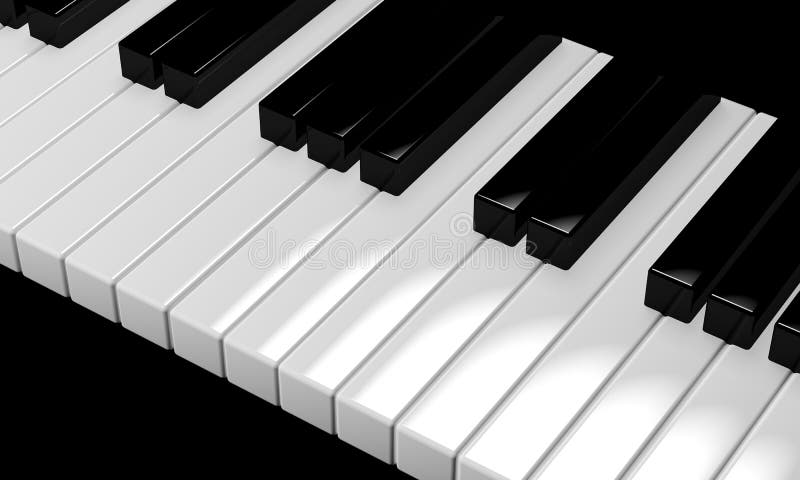
Find the location of `piano`. piano is located at coordinates (366, 296).